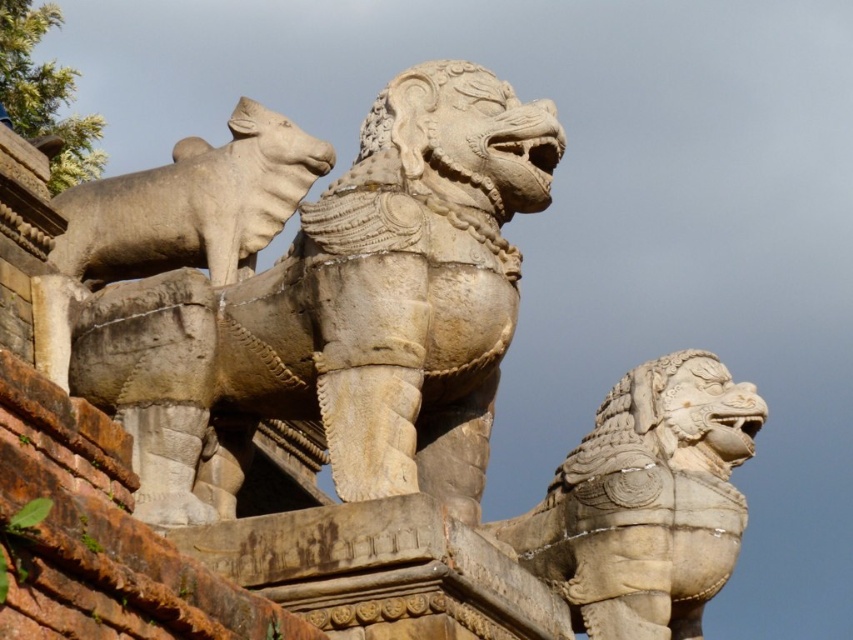
Question: Among these objects, which one is farthest from the camera?

Choices:
 (A) stone lion at center
 (B) stone lion at right
 (C) gray stone bull at upper left

Answer: (C)

Question: Is stone lion at right below gray stone bull at upper left?

Choices:
 (A) yes
 (B) no

Answer: (A)

Question: Which of the following is the closest to the observer?

Choices:
 (A) stone lion at right
 (B) stone lion at center
 (C) gray stone bull at upper left

Answer: (B)

Question: Is stone lion at center to the left of stone lion at right from the viewer's perspective?

Choices:
 (A) yes
 (B) no

Answer: (A)

Question: Can you confirm if stone lion at center is positioned to the right of gray stone bull at upper left?

Choices:
 (A) yes
 (B) no

Answer: (A)

Question: Which is farther from the stone lion at center?

Choices:
 (A) gray stone bull at upper left
 (B) stone lion at right

Answer: (B)